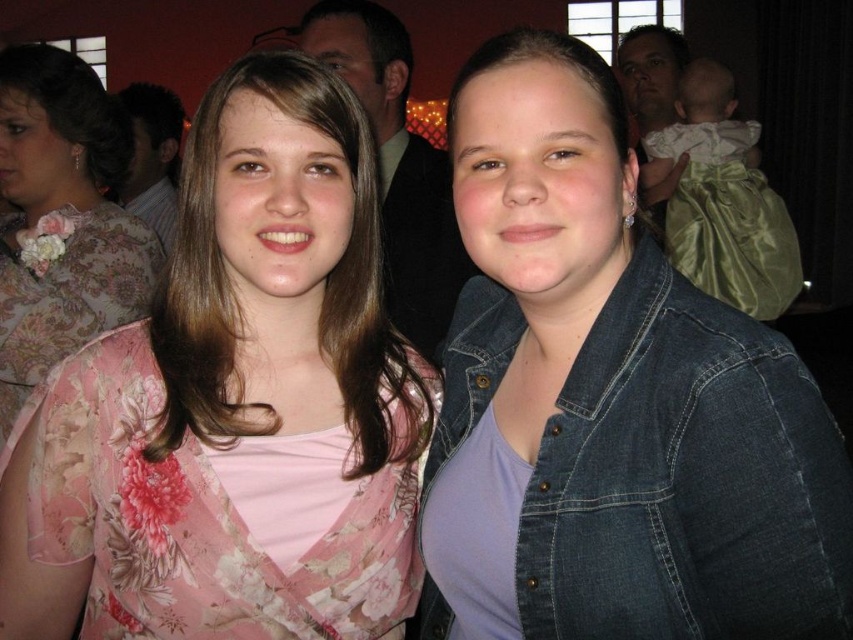
Question: Estimate the real-world distances between objects in this image. Which object is closer to the floral fabric dress at left?

Choices:
 (A) denim jacket at lower right
 (B) floral lace dress at left

Answer: (A)

Question: Does floral lace dress at left have a larger size compared to pink floral dress at center?

Choices:
 (A) yes
 (B) no

Answer: (B)

Question: Estimate the real-world distances between objects in this image. Which object is closer to the pink floral dress at center?

Choices:
 (A) floral lace dress at left
 (B) floral fabric dress at left
 (C) denim jacket at lower right

Answer: (B)

Question: Considering the relative positions of denim jacket at lower right and floral lace dress at left in the image provided, where is denim jacket at lower right located with respect to floral lace dress at left?

Choices:
 (A) right
 (B) left

Answer: (A)

Question: Which of the following is the farthest from the observer?

Choices:
 (A) (410, 262)
 (B) (437, 547)
 (C) (419, 358)
 (D) (36, 108)

Answer: (A)

Question: Is denim jacket at lower right positioned behind floral fabric dress at left?

Choices:
 (A) no
 (B) yes

Answer: (A)